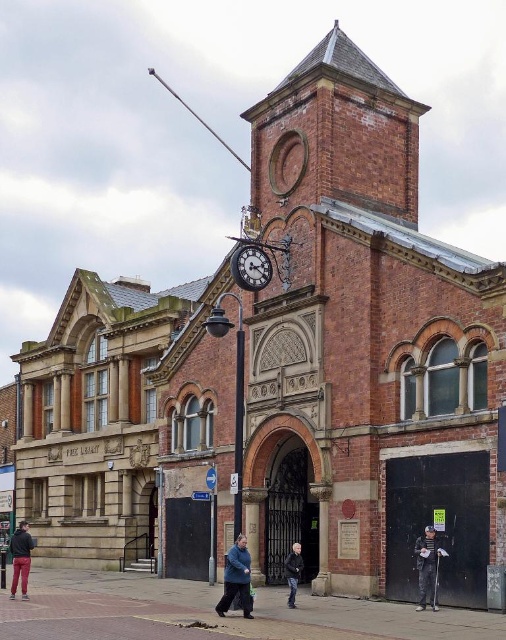
Question: Can you confirm if polished brass clock at center is wider than matte black jacket at lower left?

Choices:
 (A) yes
 (B) no

Answer: (B)

Question: Can you confirm if blue fuzzy coat at center is wider than polished brass clock at center?

Choices:
 (A) yes
 (B) no

Answer: (B)

Question: Is blue fuzzy coat at center bigger than polished brass clock at center?

Choices:
 (A) no
 (B) yes

Answer: (B)

Question: Which point appears farthest from the camera in this image?

Choices:
 (A) (434, 602)
 (B) (270, 280)
 (C) (27, 570)

Answer: (B)

Question: Which object is positioned closest to the dark gray fabric jacket at lower right?

Choices:
 (A) matte black jacket at lower left
 (B) blue fuzzy coat at center
 (C) polished brass clock at center

Answer: (B)

Question: Which of the following is the closest to the observer?

Choices:
 (A) (286, 568)
 (B) (21, 566)

Answer: (A)